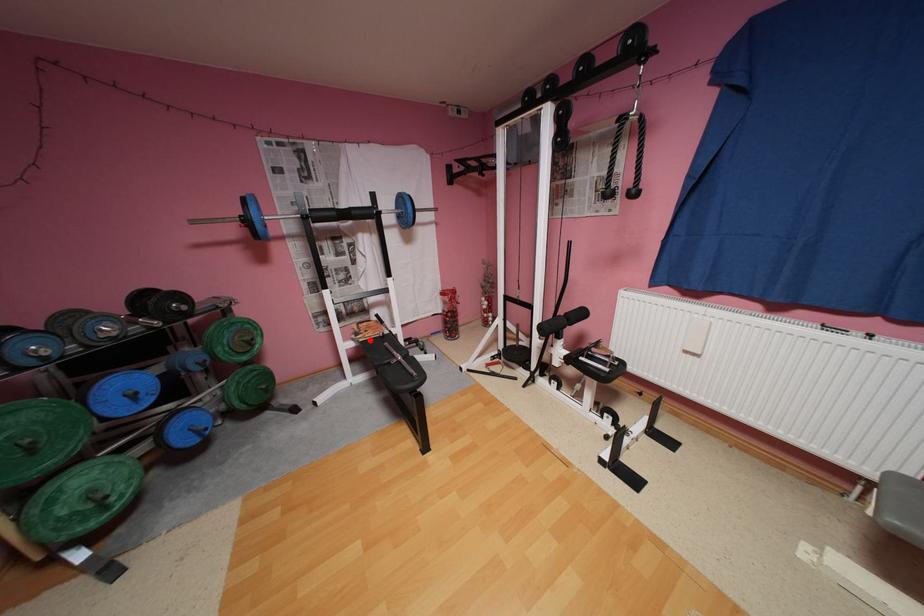
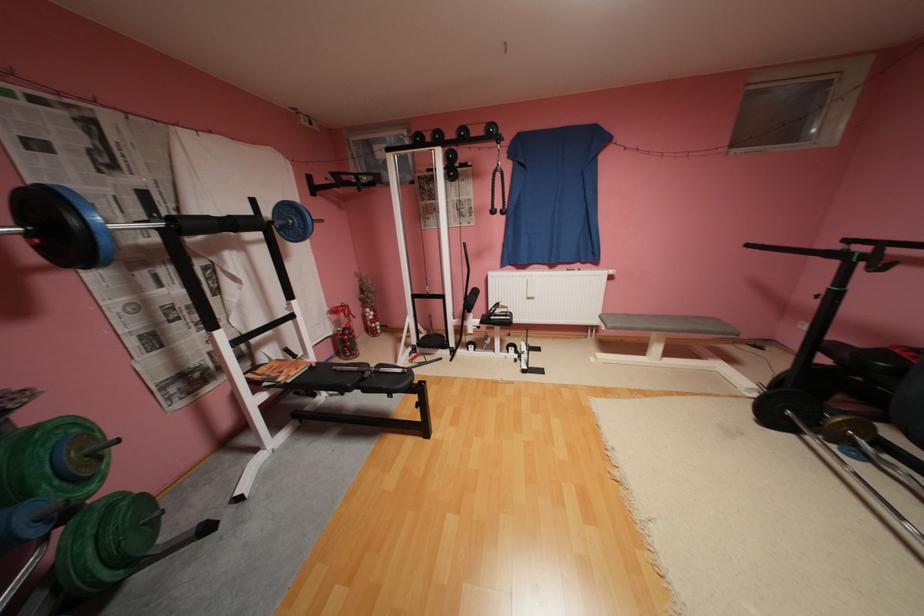
Question: A red point is marked in image1. In image2, is the corresponding 3D point closer to the camera or farther? Reply with the corresponding letter.

Choices:
 (A) The corresponding 3D point is closer.
 (B) The corresponding 3D point is farther.

Answer: (A)